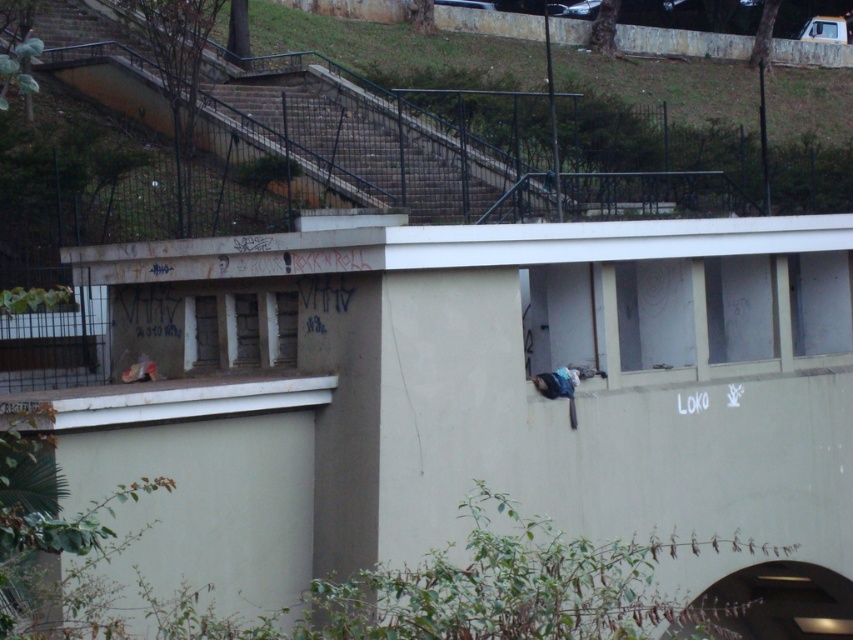
You are a maintenance worker needing to carry a large tool box. You see the metallic gray stairs at upper center and the transparent glass window at upper right. Which one has a wider structure to allow you to carry your box comfortably?

The metallic gray stairs at upper center has a larger width than the transparent glass window at upper right, so it is wider and can accommodate the tool box more comfortably.

You are standing at the base of the stairs in the image. You see two points marked as point 1 and point 2. Point 1 is at coordinates point (352,154) and point 2 is at coordinates point (498,156). Which point is closer to you?

Point 1 is closer to you because it is in front of point 2.